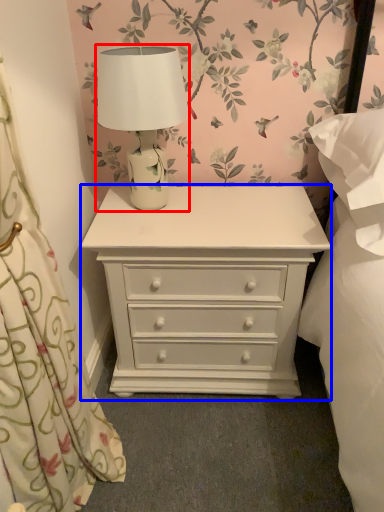
Question: Which object appears farthest to the camera in this image, table lamp (highlighted by a red box) or chest of drawers (highlighted by a blue box)?

Choices:
 (A) table lamp
 (B) chest of drawers

Answer: (B)